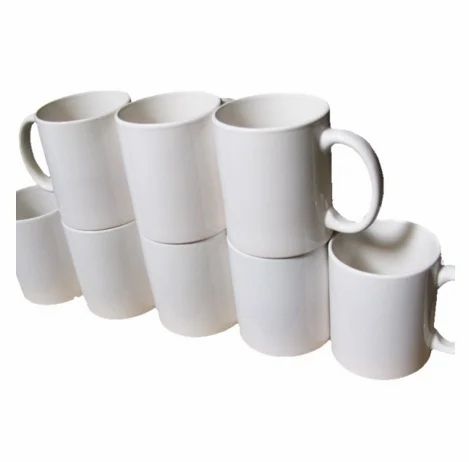
Identify the location of mugs on bottom row. Image resolution: width=469 pixels, height=462 pixels. pyautogui.click(x=42, y=243), pyautogui.click(x=85, y=252), pyautogui.click(x=170, y=257), pyautogui.click(x=297, y=286), pyautogui.click(x=363, y=288).